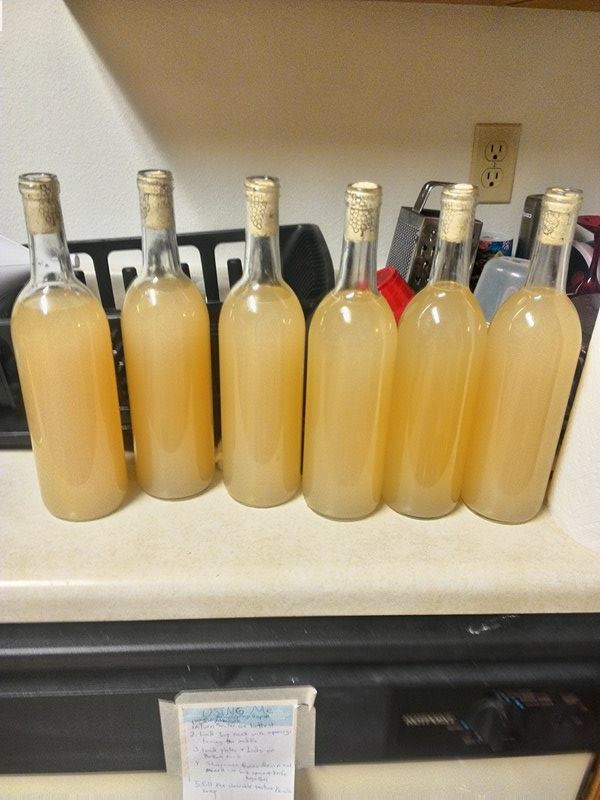
The height and width of the screenshot is (800, 600). I want to click on white work surface, so (223, 537).